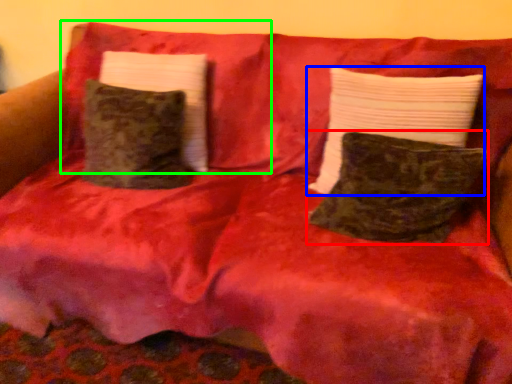
Question: Estimate the real-world distances between objects in this image. Which object is closer to pillow (highlighted by a red box), pillow (highlighted by a blue box) or pillow (highlighted by a green box)?

Choices:
 (A) pillow
 (B) pillow

Answer: (A)